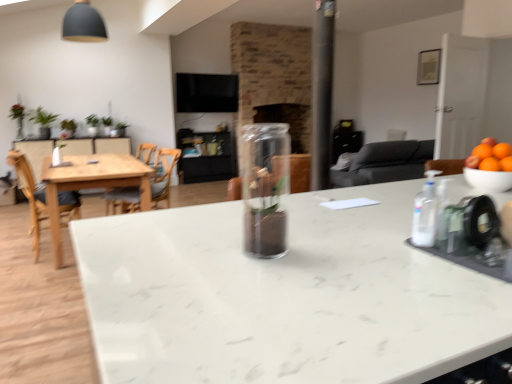
Question: Is wooden chair at left, the first chair viewed from the left, surrounding light wood table at left?

Choices:
 (A) yes
 (B) no

Answer: (B)

Question: Is the position of wooden chair at left, which ranks as the 2th chair in right-to-left order, less distant than that of light wood table at left?

Choices:
 (A) yes
 (B) no

Answer: (B)

Question: Can you confirm if wooden chair at left, which ranks as the 2th chair in right-to-left order, is shorter than light wood table at left?

Choices:
 (A) yes
 (B) no

Answer: (B)

Question: From the image's perspective, is wooden chair at left, the first chair viewed from the left, on light wood table at left?

Choices:
 (A) yes
 (B) no

Answer: (B)

Question: Is the surface of wooden chair at left, which ranks as the 2th chair in right-to-left order, in direct contact with light wood table at left?

Choices:
 (A) yes
 (B) no

Answer: (B)

Question: From a real-world perspective, is wooden chair at left, which ranks as the 2th chair in right-to-left order, physically below light wood table at left?

Choices:
 (A) no
 (B) yes

Answer: (A)

Question: Is orange matte bowl at right facing away from light wood table at left?

Choices:
 (A) yes
 (B) no

Answer: (B)

Question: Is orange matte bowl at right not near light wood table at left?

Choices:
 (A) yes
 (B) no

Answer: (A)

Question: Considering the relative sizes of orange matte bowl at right and light wood table at left in the image provided, is orange matte bowl at right taller than light wood table at left?

Choices:
 (A) yes
 (B) no

Answer: (B)

Question: From the image's perspective, is orange matte bowl at right under light wood table at left?

Choices:
 (A) no
 (B) yes

Answer: (A)

Question: Does orange matte bowl at right have a lesser height compared to light wood table at left?

Choices:
 (A) no
 (B) yes

Answer: (B)

Question: Is orange matte bowl at right outside of light wood table at left?

Choices:
 (A) no
 (B) yes

Answer: (B)

Question: Considering the relative positions of orange matte bowl at right and white marble countertop at center in the image provided, is orange matte bowl at right to the right of white marble countertop at center from the viewer's perspective?

Choices:
 (A) yes
 (B) no

Answer: (A)